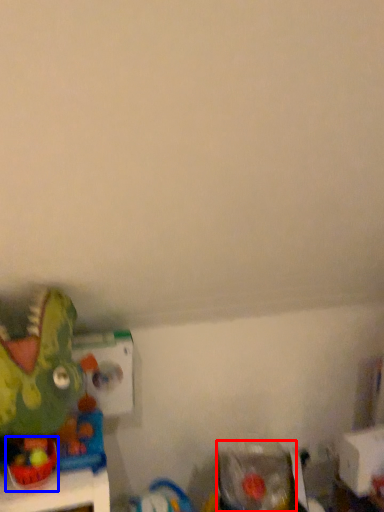
Question: Which of the following is the farthest to the observer, toy (highlighted by a red box) or toy (highlighted by a blue box)?

Choices:
 (A) toy
 (B) toy

Answer: (A)